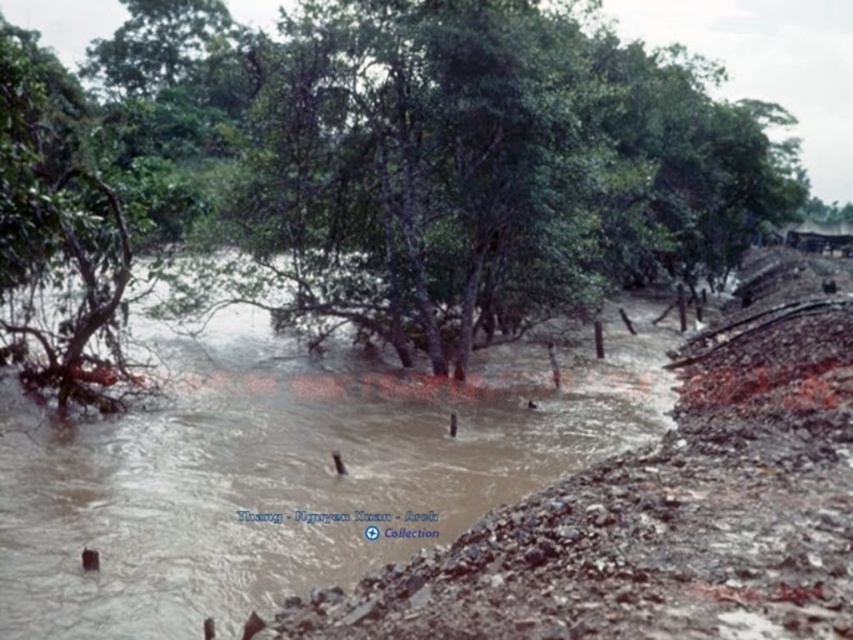
Who is higher up, green matte tree at center or brown muddy water at center?

green matte tree at center

Which is in front, point (36, 157) or point (326, 436)?

Positioned in front is point (36, 157).

Does point (630, 113) come farther from viewer compared to point (357, 484)?

Yes, it is.

Where is `green matte tree at center`? The image size is (853, 640). green matte tree at center is located at coordinates (376, 170).